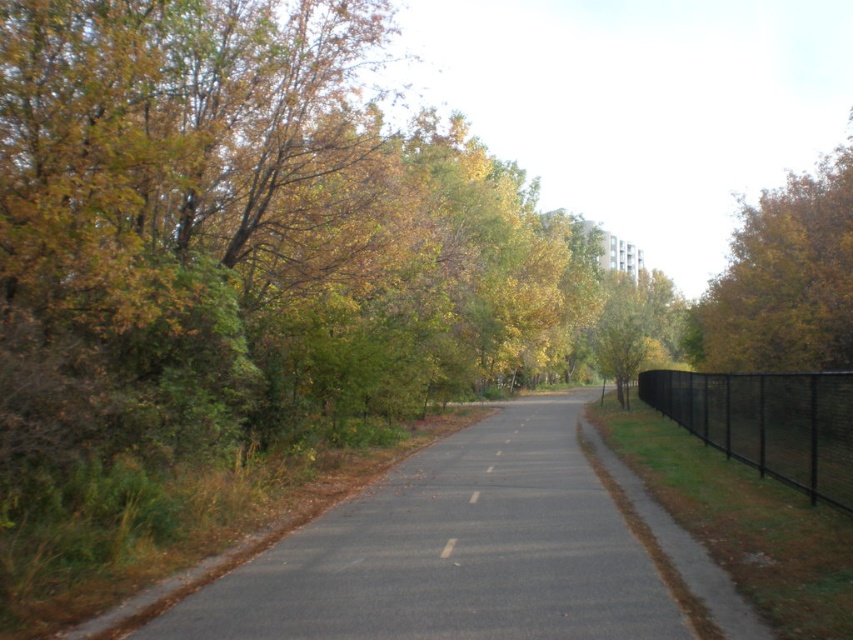
Question: Which of the following is the closest to the observer?

Choices:
 (A) white glossy line at center
 (B) black chain-link fence at right

Answer: (B)

Question: Which object is positioned farthest from the yellow-green foliage at upper right?

Choices:
 (A) black asphalt road at center
 (B) white paper at center

Answer: (B)

Question: Can you confirm if black chain-link fence at right is smaller than white glossy line at center?

Choices:
 (A) no
 (B) yes

Answer: (A)

Question: Which object appears closest to the camera in this image?

Choices:
 (A) white glossy line at center
 (B) black asphalt road at center
 (C) yellow-green foliage at upper right

Answer: (A)

Question: Is asphalt road at center further to camera compared to black chain-link fence at right?

Choices:
 (A) no
 (B) yes

Answer: (A)

Question: Can you confirm if asphalt road at center is positioned to the left of white paper at center?

Choices:
 (A) no
 (B) yes

Answer: (A)